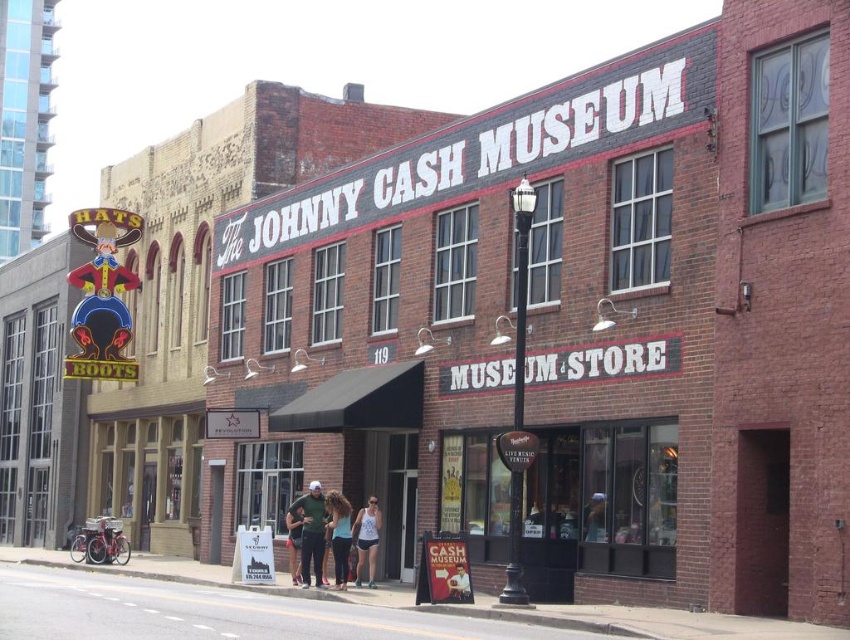
Question: Can you confirm if green cotton shirt at center is bigger than matte blue shorts at center?

Choices:
 (A) no
 (B) yes

Answer: (A)

Question: Among these points, which one is nearest to the camera?

Choices:
 (A) (310, 538)
 (B) (329, 492)
 (C) (377, 552)
 (D) (108, 436)

Answer: (A)

Question: Among these points, which one is farthest from the camera?

Choices:
 (A) (302, 529)
 (B) (327, 518)

Answer: (A)

Question: Does matte glass window at center appear over white mesh tank top at center?

Choices:
 (A) no
 (B) yes

Answer: (B)

Question: Is green cotton shirt at center to the right of matte blue shorts at center from the viewer's perspective?

Choices:
 (A) no
 (B) yes

Answer: (A)

Question: Which object is farther from the camera taking this photo?

Choices:
 (A) matte blue shorts at center
 (B) white mesh tank top at center
 (C) green cotton shirt at center

Answer: (C)